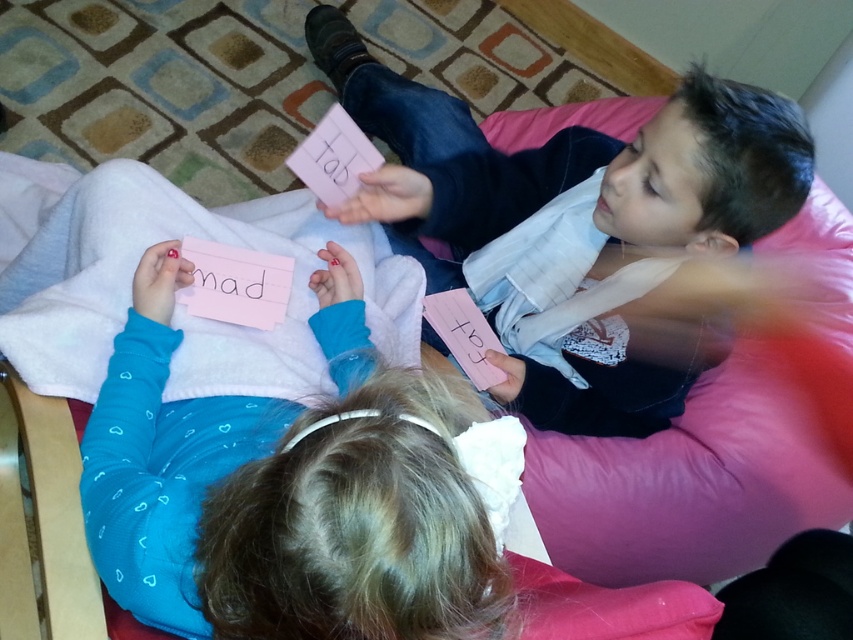
Question: Among these points, which one is nearest to the camera?

Choices:
 (A) (112, 484)
 (B) (328, 72)

Answer: (A)

Question: Does pink paper card at center have a larger size compared to matte pink card at upper right?

Choices:
 (A) no
 (B) yes

Answer: (A)

Question: Does pink paper card at center appear over matte pink card at upper right?

Choices:
 (A) yes
 (B) no

Answer: (B)

Question: Which object appears farthest from the camera in this image?

Choices:
 (A) pink paper card at center
 (B) matte pink card at upper right

Answer: (B)

Question: Can you confirm if pink paper card at center is positioned below matte pink card at upper right?

Choices:
 (A) yes
 (B) no

Answer: (A)